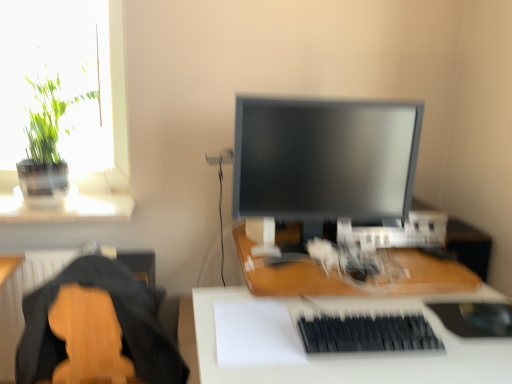
The width and height of the screenshot is (512, 384). Identify the location of vacant area located to the right-hand side of black matte keyboard at lower center. (461, 343).